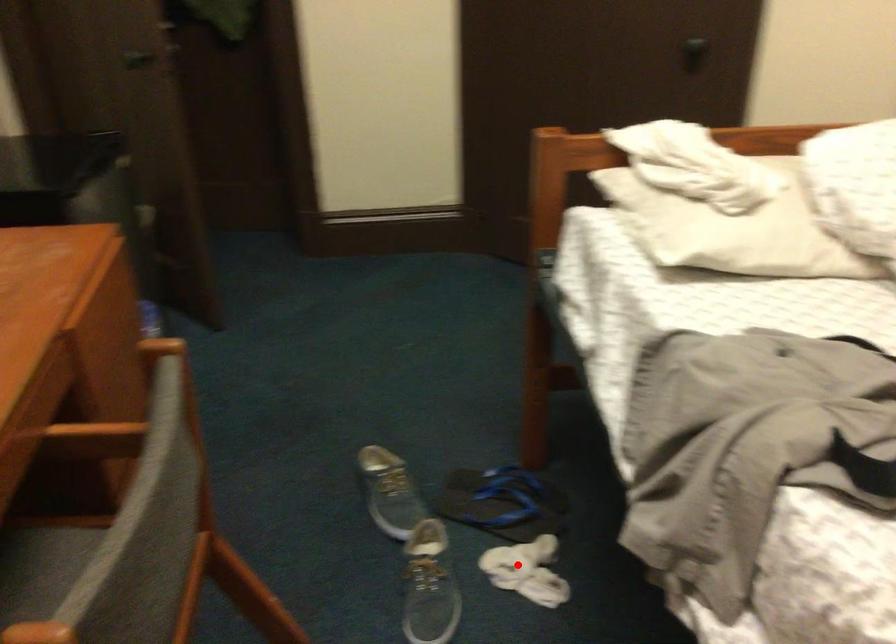
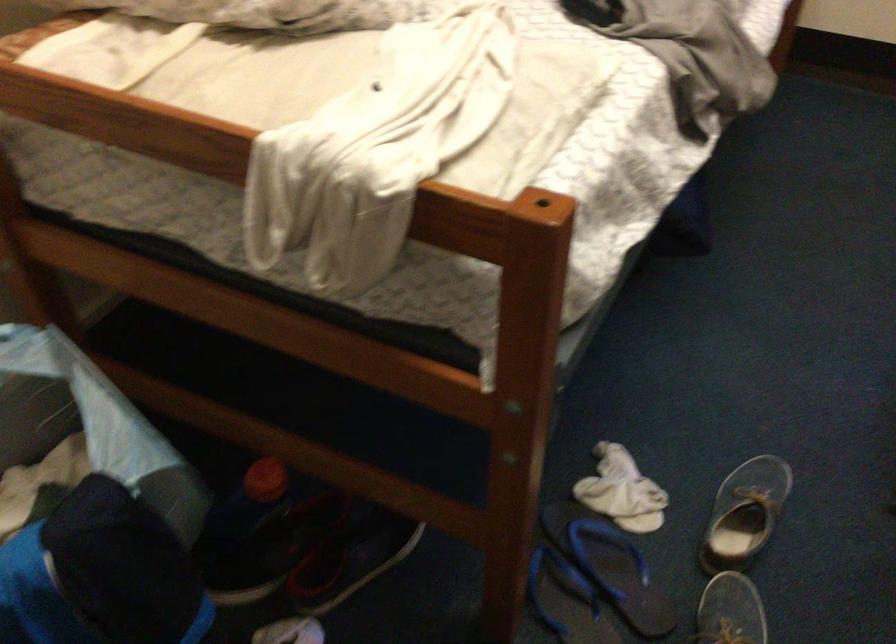
Locate, in the second image, the point that corresponds to the highlighted location in the first image.

(622, 491)